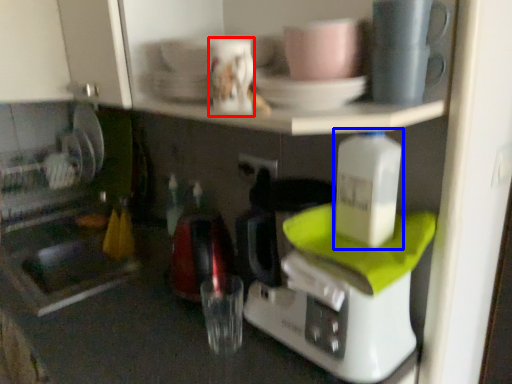
Question: Which point is closer to the camera, coffee cup (highlighted by a red box) or bottle (highlighted by a blue box)?

Choices:
 (A) coffee cup
 (B) bottle

Answer: (B)